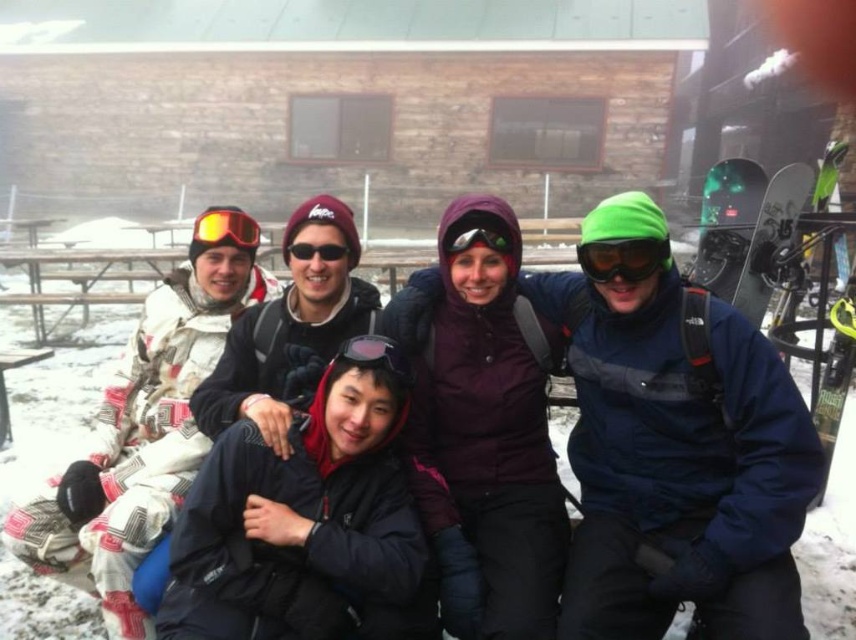
Question: Which object appears farthest from the camera in this image?

Choices:
 (A) black matte goggles at center
 (B) black matte jacket at center

Answer: (A)

Question: Is matte yellow goggles at upper left smaller than sunglasses at center?

Choices:
 (A) yes
 (B) no

Answer: (B)

Question: Is black matte goggles at center positioned at the back of matte black goggles at center?

Choices:
 (A) no
 (B) yes

Answer: (B)

Question: Does green matte goggles at center appear over sunglasses at center?

Choices:
 (A) yes
 (B) no

Answer: (A)

Question: Which of the following is the farthest from the observer?

Choices:
 (A) (327, 244)
 (B) (361, 372)
 (C) (502, 248)
 (D) (360, 355)

Answer: (A)

Question: Estimate the real-world distances between objects in this image. Which object is closer to the green matte goggles at center?

Choices:
 (A) black matte jacket at center
 (B) matte black goggles at center
 (C) sunglasses at center
 (D) matte yellow goggles at upper left

Answer: (B)